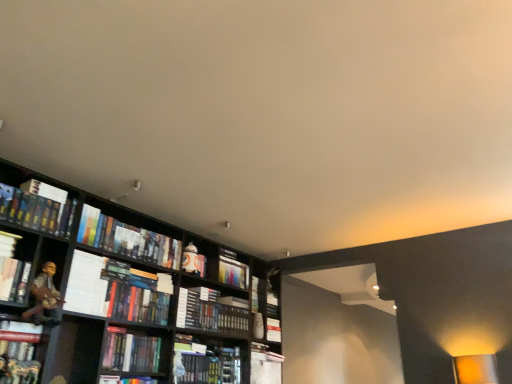
Question: From the image's perspective, is white paper at left located above or below hardcover book at center, acting as the third book starting from the right?

Choices:
 (A) above
 (B) below

Answer: (A)

Question: Do you think white paper at left is within hardcover book at center, the eighth book in the left-to-right sequence, or outside of it?

Choices:
 (A) inside
 (B) outside

Answer: (B)

Question: Estimate the real-world distances between objects in this image. Which object is farther from the hardcover book at upper center, acting as the ninth book starting from the left?

Choices:
 (A) hardcover book at center, acting as the third book starting from the right
 (B) hardcover book at left, acting as the 10th book starting from the right
 (C) hardcover book at center, the tenth book from the left
 (D) hardcover book at center, the fourth book positioned from the left
 (E) hardcover books at center, which is the seventh book from left to right

Answer: (B)

Question: Which is nearer to the hardcover books at center, placed as the fourth book when sorted from right to left?

Choices:
 (A) hardcover book at upper center, acting as the ninth book starting from the left
 (B) hardcover book at left, acting as the 10th book starting from the right
 (C) hardcover book at center, positioned as the first book in right-to-left order
 (D) hardcover book at left, positioned as the third book in left-to-right order
 (E) matte black book at lower left, acting as the ninth book starting from the right

Answer: (D)